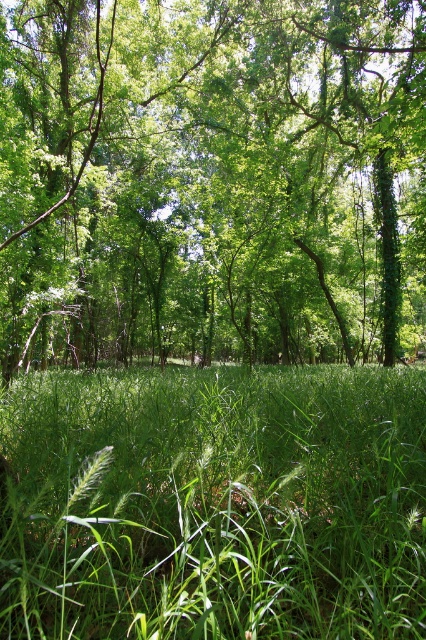
Is green leafy tree at center shorter than green grassy at center?

No, green leafy tree at center is not shorter than green grassy at center.

Does green leafy tree at center appear on the right side of green grassy at center?

Incorrect, green leafy tree at center is not on the right side of green grassy at center.

Identify the location of green leafy tree at center. (212, 179).